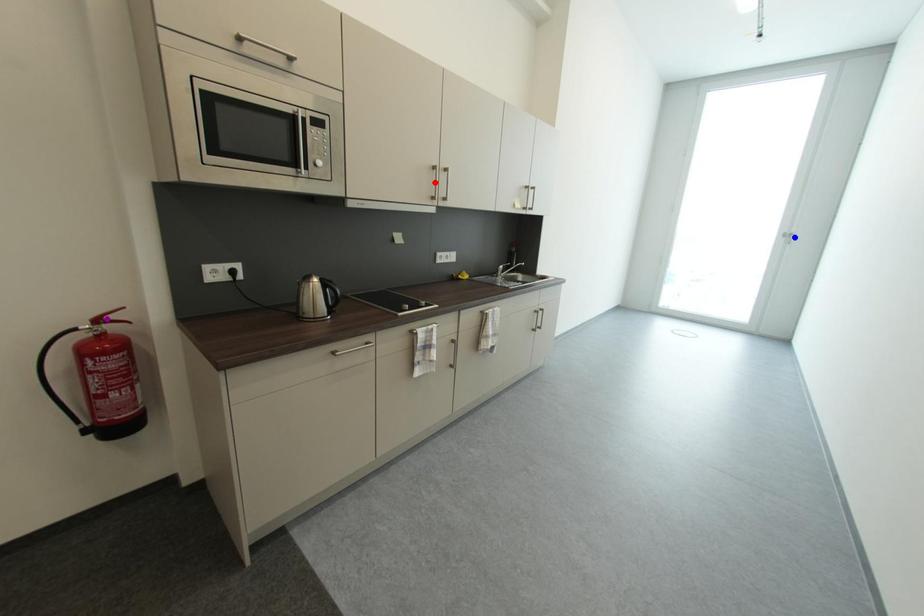
Order these from nearest to farthest:
A) red point
B) blue point
C) purple point

blue point < red point < purple point